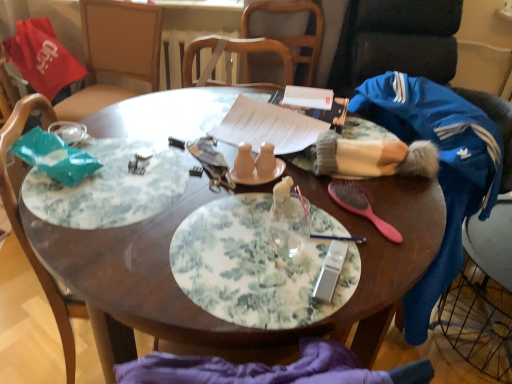
The height and width of the screenshot is (384, 512). I want to click on empty space that is to the right of metallic silver pen at center, which is counted as the second tableware, starting from the right, so click(398, 235).